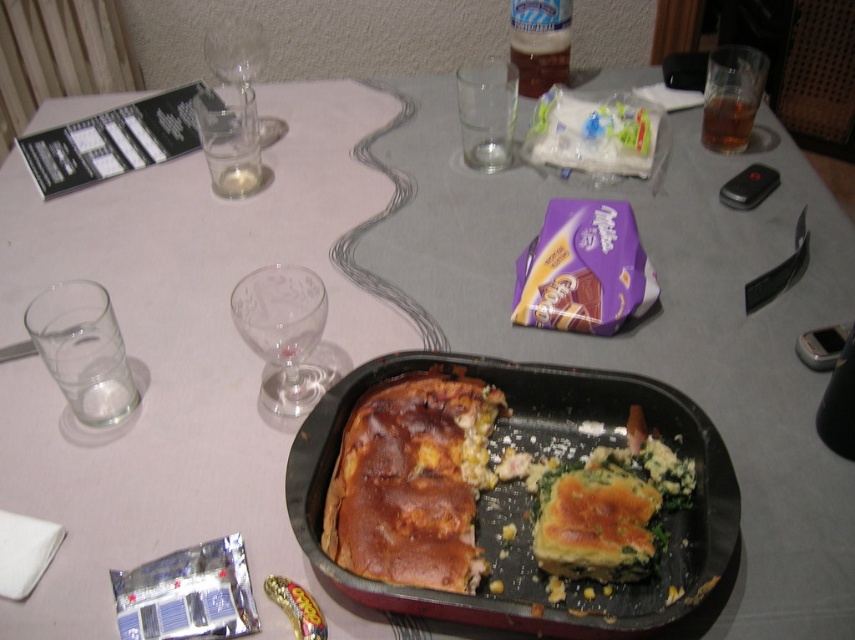
Is black plastic tray at center above golden brown crusty bread at center?

Incorrect, black plastic tray at center is not positioned above golden brown crusty bread at center.

Which of these two, black plastic tray at center or golden brown crusty bread at center, stands taller?

black plastic tray at center

Who is more distant from viewer, (423, 349) or (404, 440)?

Positioned behind is point (423, 349).

I want to click on black plastic tray at center, so click(541, 432).

Who is positioned more to the left, black plastic tray at center or brown translucent glass at upper right?

black plastic tray at center

From the picture: Who is more forward, (723, 460) or (740, 141)?

Point (723, 460) is more forward.

Is point (540, 381) in front of point (732, 109)?

Yes, point (540, 381) is closer to viewer.

Identify the location of black plastic tray at center. This screenshot has height=640, width=855. (541, 432).

Can you confirm if black plastic tray at center is positioned below transparent glass wine glass at upper left?

Correct, black plastic tray at center is located below transparent glass wine glass at upper left.

Can you confirm if black plastic tray at center is thinner than transparent glass wine glass at upper left?

No, black plastic tray at center is not thinner than transparent glass wine glass at upper left.

At what (x,y) coordinates should I click in order to perform the action: click on black plastic tray at center. Please return your answer as a coordinate pair (x, y). Looking at the image, I should click on (541, 432).

Where is `black plastic tray at center`? The image size is (855, 640). black plastic tray at center is located at coordinates (541, 432).